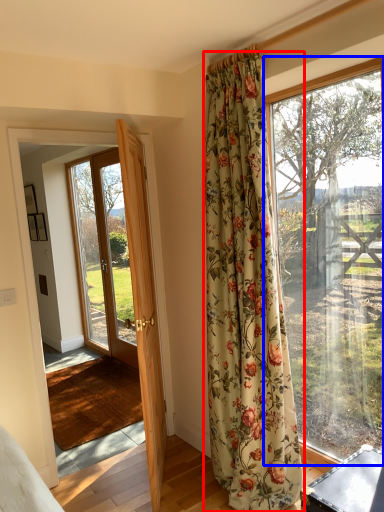
Question: Which of the following is the closest to the observer, curtain (highlighted by a red box) or window (highlighted by a blue box)?

Choices:
 (A) curtain
 (B) window

Answer: (A)